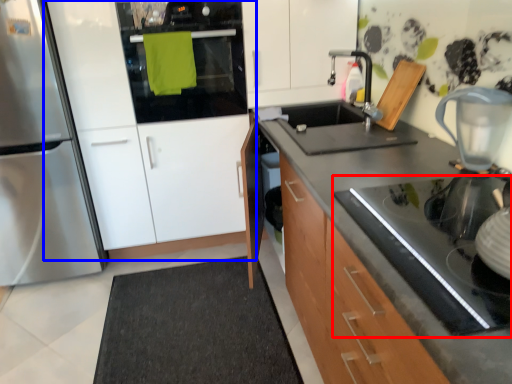
Question: Which object appears farthest to the camera in this image, gas stove (highlighted by a red box) or cabinetry (highlighted by a blue box)?

Choices:
 (A) gas stove
 (B) cabinetry

Answer: (B)